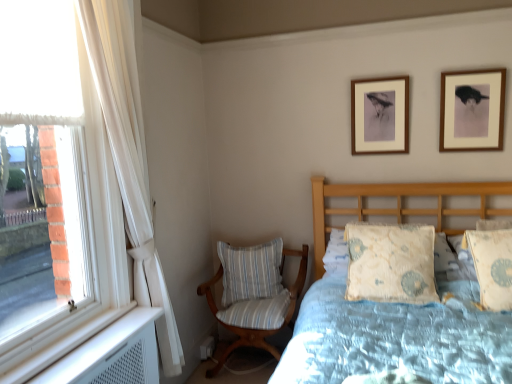
Question: Does striped fabric chair at lower left have a lesser width compared to light blue floral fabric pillow at right, the 1th pillow from the right?

Choices:
 (A) yes
 (B) no

Answer: (B)

Question: Can you confirm if striped fabric chair at lower left is positioned to the left of light blue floral fabric pillow at right, the first pillow from the front?

Choices:
 (A) yes
 (B) no

Answer: (A)

Question: Is striped fabric chair at lower left aimed at light blue floral fabric pillow at right, placed as the 3th pillow when sorted from left to right?

Choices:
 (A) yes
 (B) no

Answer: (B)

Question: Can you confirm if striped fabric chair at lower left is bigger than light blue floral fabric pillow at right, the 1th pillow from the right?

Choices:
 (A) yes
 (B) no

Answer: (A)

Question: From a real-world perspective, does striped fabric chair at lower left stand above light blue floral fabric pillow at right, the 1th pillow from the right?

Choices:
 (A) yes
 (B) no

Answer: (B)

Question: From the image's perspective, is striped fabric chair at lower left on top of light blue floral fabric pillow at right, the 3th pillow from the back?

Choices:
 (A) yes
 (B) no

Answer: (B)

Question: Is light blue floral fabric pillow at right, the 3th pillow from the back, not within wooden picture frame at upper center, the 1th picture frame in the back-to-front sequence?

Choices:
 (A) yes
 (B) no

Answer: (A)

Question: From the image's perspective, would you say light blue floral fabric pillow at right, the 1th pillow from the right, is shown under wooden picture frame at upper center, the 1th picture frame in the back-to-front sequence?

Choices:
 (A) no
 (B) yes

Answer: (B)

Question: From a real-world perspective, is light blue floral fabric pillow at right, the 3th pillow from the back, physically above wooden picture frame at upper center, marked as the second picture frame in a right-to-left arrangement?

Choices:
 (A) no
 (B) yes

Answer: (A)

Question: Is light blue floral fabric pillow at right, the 3th pillow from the back, thinner than wooden picture frame at upper center, the 2th picture frame from the front?

Choices:
 (A) yes
 (B) no

Answer: (B)

Question: Is wooden picture frame at upper center, the 1th picture frame in the back-to-front sequence, at the back of light blue floral fabric pillow at right, the first pillow from the front?

Choices:
 (A) no
 (B) yes

Answer: (A)

Question: Does light blue floral fabric pillow at right, the 1th pillow from the right, have a greater height compared to wooden picture frame at upper center, which is counted as the first picture frame, starting from the left?

Choices:
 (A) no
 (B) yes

Answer: (B)

Question: Can you confirm if wooden picture frame at upper center, the 1th picture frame in the back-to-front sequence, is shorter than striped fabric chair at lower left?

Choices:
 (A) no
 (B) yes

Answer: (B)